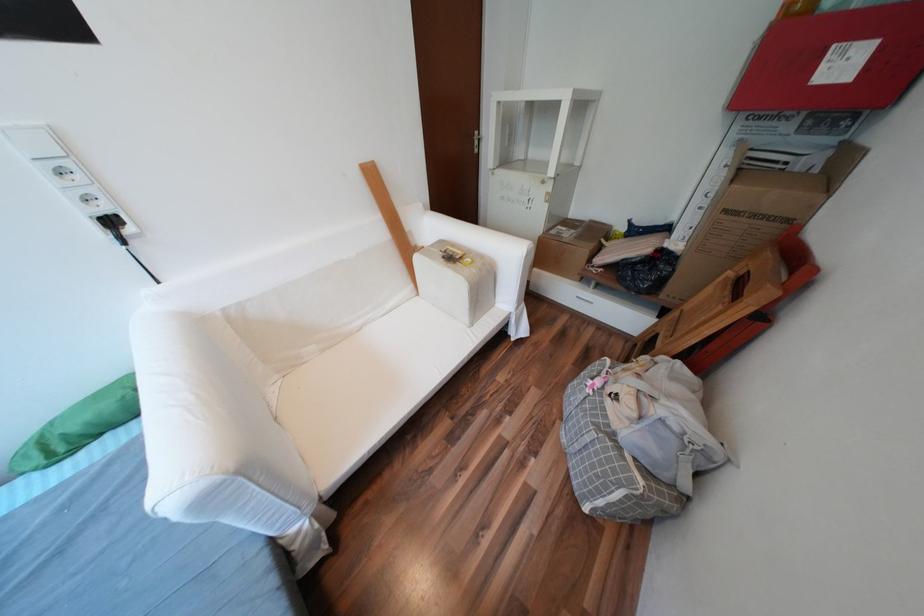
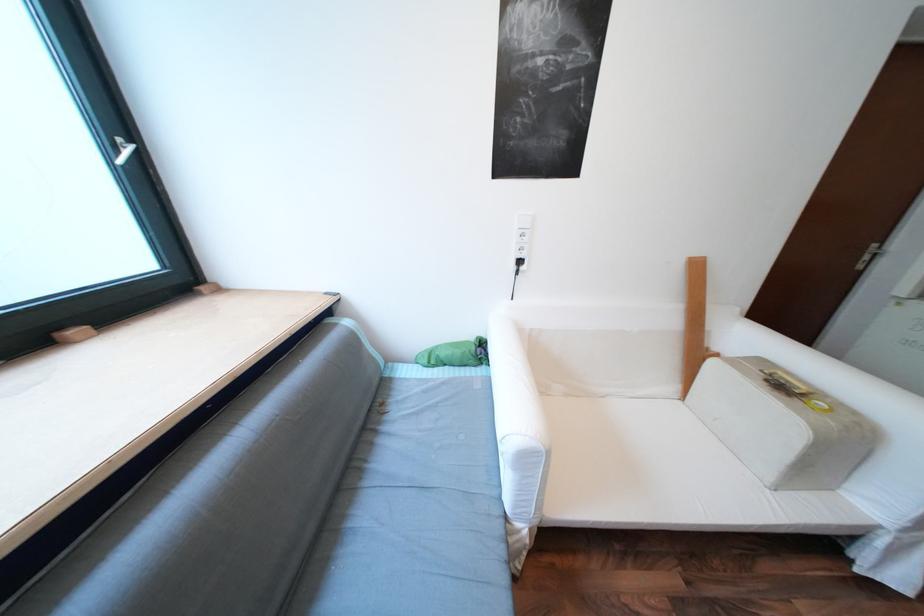
Locate, in the second image, the point that corresponds to point 469,257 in the first image.

(811, 394)